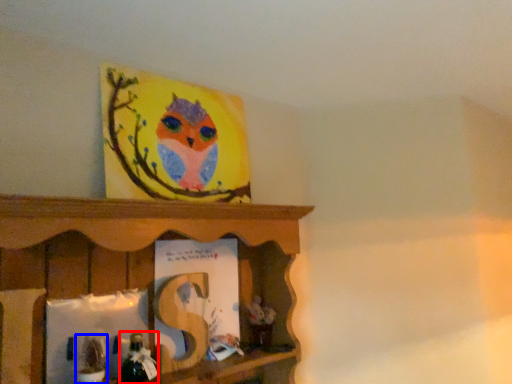
Question: Which object appears closest to the camera in this image, toy (highlighted by a red box) or toy (highlighted by a blue box)?

Choices:
 (A) toy
 (B) toy

Answer: (B)